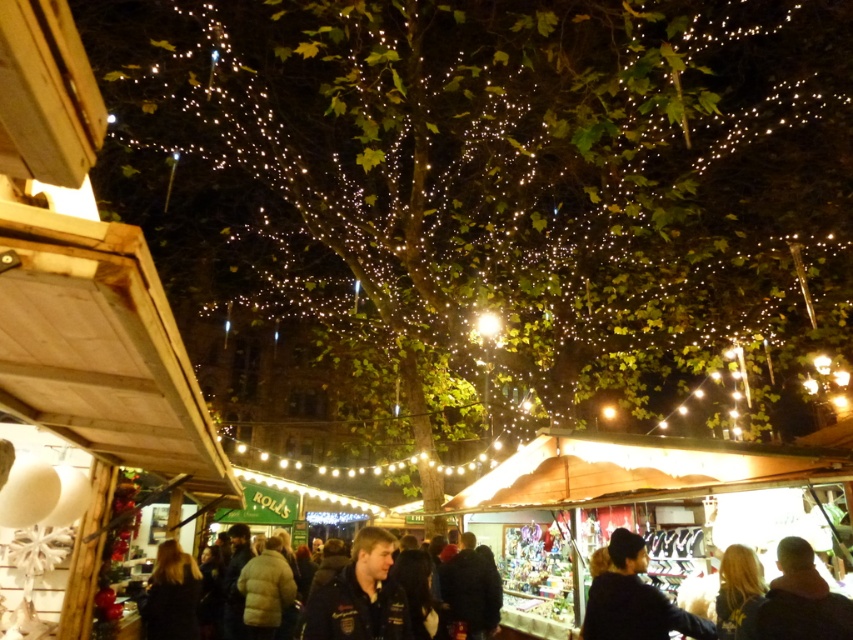
In the scene shown: You are a customer at the night market and want to buy a jacket. You see the dark blue jacket at center and the dark brown leather jacket at lower right. Which jacket is positioned lower in the scene?

The dark blue jacket at center is positioned lower than the dark brown leather jacket at lower right.

You are a customer at the night market and want to buy a dark brown leather jacket at lower right. You see a person with dark brown hair at center standing in front of the jacket. Can you walk around the person to reach the jacket?

The dark brown leather jacket at lower right is positioned on the right side of dark brown hair at center. So you can walk around the person with dark brown hair at center to reach the jacket by moving to the right side of them.

You are a customer at the night market and want to buy the dark blue knit hat at center. However, it is currently covered by the dark brown leather jacket at lower right. Can you easily access the hat without moving the jacket?

The dark blue knit hat at center is positioned under the dark brown leather jacket at lower right, so you would need to move the jacket to access the hat.